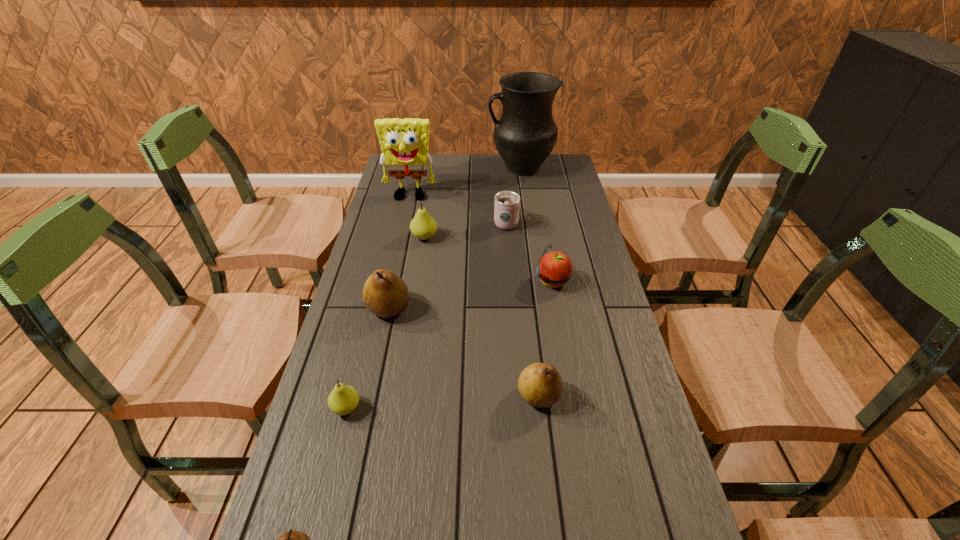
Find the location of a particular element. This screenshot has width=960, height=540. the farthest object is located at coordinates (524, 136).

The image size is (960, 540). Identify the location of black pitcher. (524, 136).

The height and width of the screenshot is (540, 960). Find the location of `sponge`. sponge is located at coordinates coord(404,142).

This screenshot has height=540, width=960. What are the coordinates of `the eighth shortest object` in the screenshot? It's located at (404, 142).

The height and width of the screenshot is (540, 960). I want to click on the third tallest object, so click(x=385, y=294).

The height and width of the screenshot is (540, 960). In order to click on the biggest brown pear in this screenshot , I will do `click(385, 294)`.

Locate an element on the screen. The image size is (960, 540). cup is located at coordinates tap(506, 209).

Identify the location of the right green pear. (422, 226).

Image resolution: width=960 pixels, height=540 pixels. In order to click on the farther green pear in this screenshot , I will do `click(422, 226)`.

You are a GUI agent. You are given a task and a screenshot of the screen. Output one action in this format:
    pyautogui.click(x=<x>, y=<y>)
    Task: Click on the second smallest brown pear
    This screenshot has height=540, width=960.
    Given the screenshot: What is the action you would take?
    pyautogui.click(x=540, y=385)